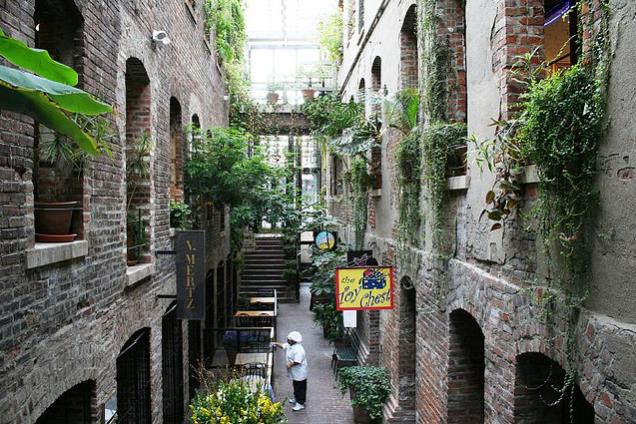
Find the location of a particular element. This screenshot has width=636, height=424. stairs is located at coordinates (261, 267).